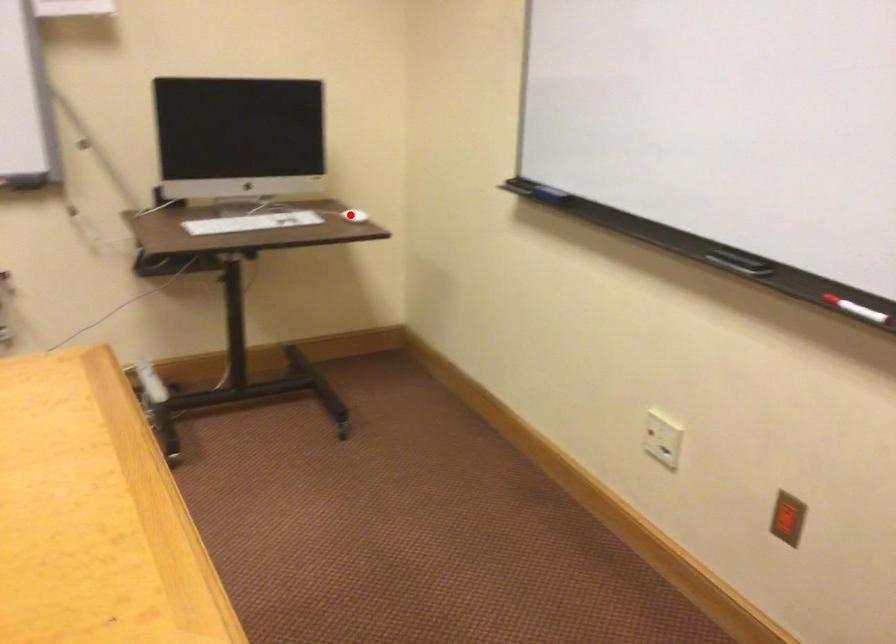
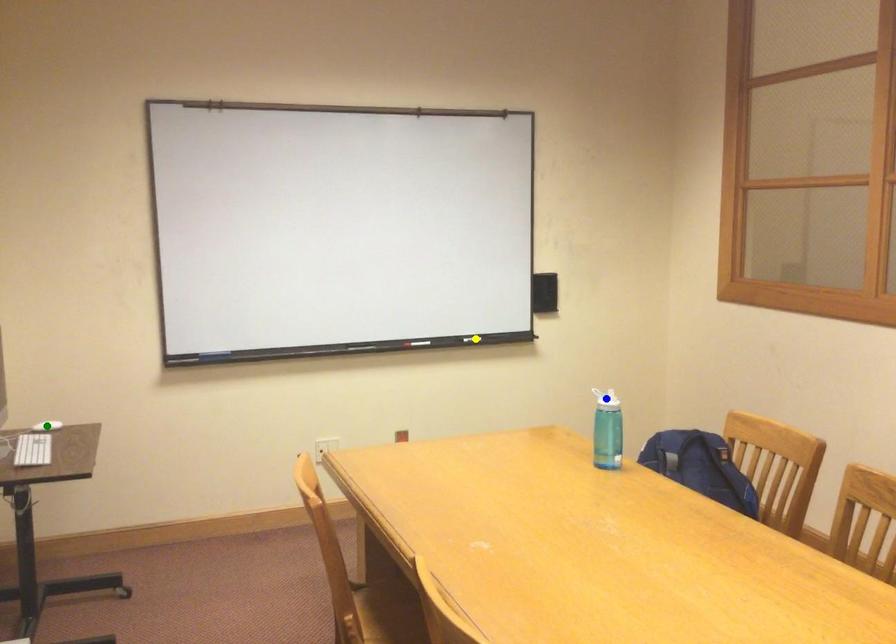
Question: I am providing you with two images of the same scene from different viewpoints. A red point is marked on the first image. You are given multiple points on the second image. Which point in image 2 is actually the same real-world point as the red point in image 1?

Choices:
 (A) blue point
 (B) green point
 (C) yellow point

Answer: (B)